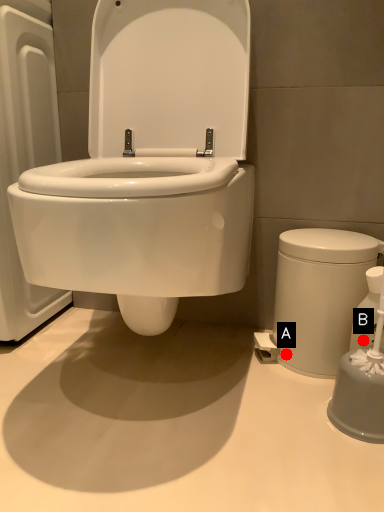
Question: Two points are circled on the image, labeled by A and B beside each circle. Which point is farther from the camera taking this photo?

Choices:
 (A) A is further
 (B) B is further

Answer: (A)